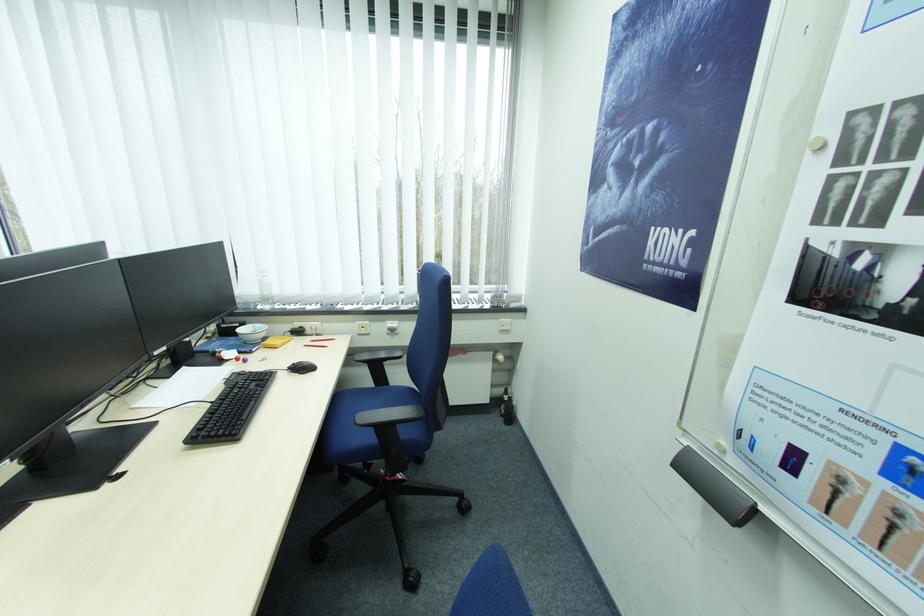
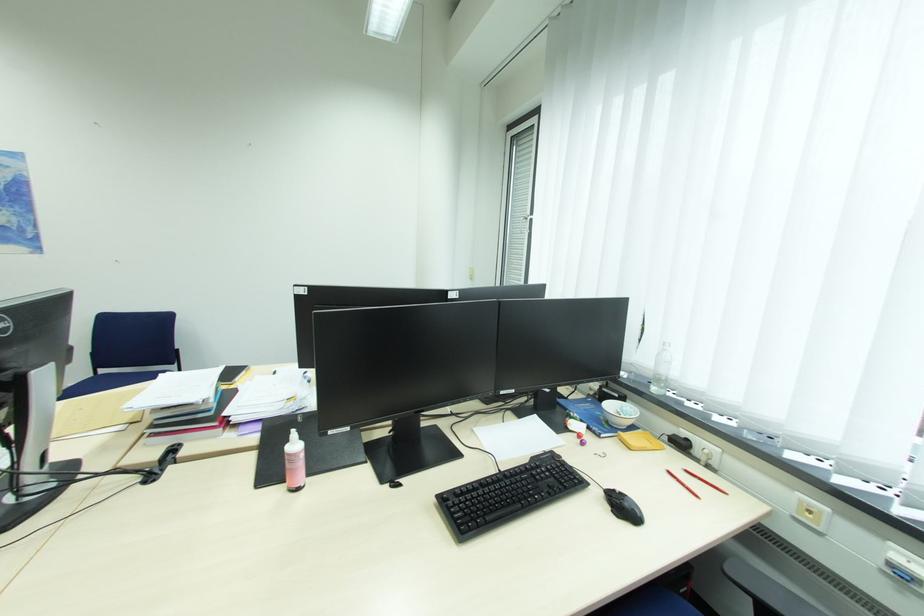
Question: Based on the continuous images, in which direction is the camera rotating? Reply with the corresponding letter.

Choices:
 (A) Left
 (B) Right
 (C) Up
 (D) Down

Answer: (A)